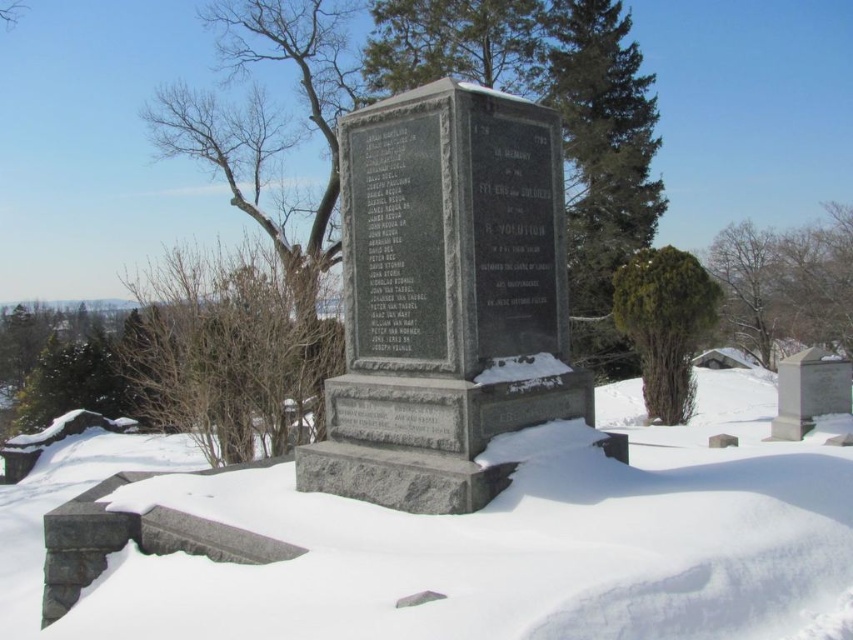
Between white powdery snow at center and green textured evergreen tree at upper right, which one is positioned lower?

white powdery snow at center is lower down.

Is white powdery snow at center shorter than green textured evergreen tree at upper right?

Yes.

Is point (582, 544) in front of point (627, 230)?

Yes.

Locate an element on the screen. white powdery snow at center is located at coordinates (479, 545).

Is point (381, 476) closer to viewer compared to point (747, 310)?

That is True.

Which is in front, point (465, 99) or point (772, 252)?

Point (465, 99) is in front.

Which is in front, point (415, 404) or point (849, 289)?

Point (415, 404)

Locate an element on the screen. The image size is (853, 640). granite stone monument at center is located at coordinates (445, 298).

What do you see at coordinates (785, 284) in the screenshot? This screenshot has height=640, width=853. I see `green leafy tree at upper right` at bounding box center [785, 284].

Which is more to the left, green leafy tree at upper right or green textured bush at right?

From the viewer's perspective, green textured bush at right appears more on the left side.

In order to click on green leafy tree at upper right in this screenshot , I will do `click(785, 284)`.

This screenshot has width=853, height=640. Identify the location of green leafy tree at upper right. (785, 284).